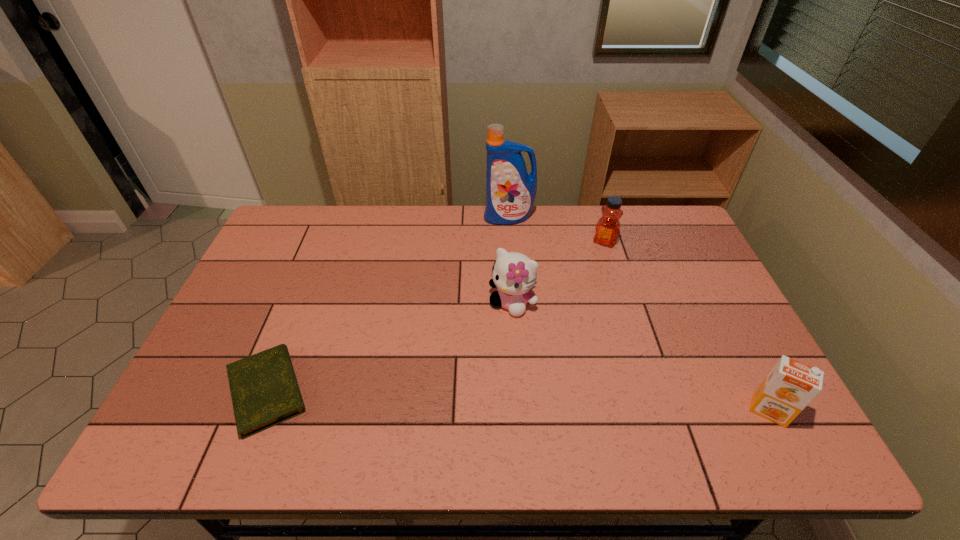
Find the location of a particular element. The width and height of the screenshot is (960, 540). blank space at the right edge of the desktop is located at coordinates (662, 264).

The image size is (960, 540). I want to click on vacant area at the far left corner, so click(x=289, y=247).

I want to click on vacant space at the far right corner of the desktop, so click(649, 227).

Where is `vacant point located between the third nearest object and the honey`? Image resolution: width=960 pixels, height=540 pixels. vacant point located between the third nearest object and the honey is located at coordinates (559, 272).

This screenshot has width=960, height=540. Identify the location of free space between the rightmost object and the tallest object. (638, 314).

Identify the location of empty space that is in between the tallest object and the rightmost object. The height and width of the screenshot is (540, 960). (638, 314).

You are a GUI agent. You are given a task and a screenshot of the screen. Output one action in this format:
    pyautogui.click(x=<x>, y=<y>)
    Task: Click on the blank region between the second object from right to left and the rightmost object
    
    Given the screenshot: What is the action you would take?
    pyautogui.click(x=686, y=326)

Where is `vacant area between the fourth nearest object and the shortest object`? This screenshot has width=960, height=540. vacant area between the fourth nearest object and the shortest object is located at coordinates (x=436, y=316).

You are a GUI agent. You are given a task and a screenshot of the screen. Output one action in this format:
    pyautogui.click(x=<x>, y=<y>)
    Task: Click on the vacant space that is in between the orange juice and the diary
    The image size is (960, 540).
    Given the screenshot: What is the action you would take?
    [518, 401]

The height and width of the screenshot is (540, 960). Find the location of `blank region between the fourth object from left to right and the farthest object`. blank region between the fourth object from left to right and the farthest object is located at coordinates (557, 230).